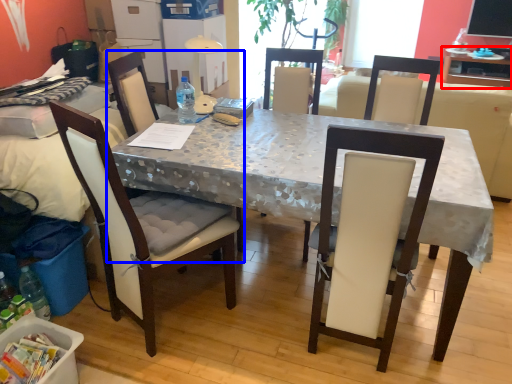
Question: Which object is closer to the camera taking this photo, table (highlighted by a red box) or chair (highlighted by a blue box)?

Choices:
 (A) table
 (B) chair

Answer: (B)